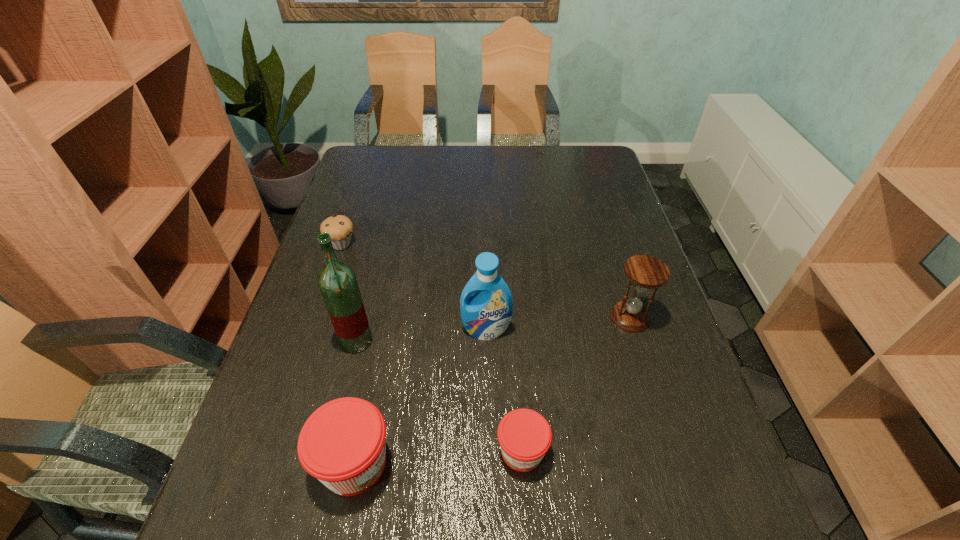
You are a GUI agent. You are given a task and a screenshot of the screen. Output one action in this format:
    pyautogui.click(x=<x>, y=<y>)
    Task: Click on the free space between the taller jam and the leftmost object
    The height and width of the screenshot is (540, 960).
    Given the screenshot: What is the action you would take?
    pyautogui.click(x=348, y=354)

Identify the location of vacant space that's between the second tallest object and the taller jam. The height and width of the screenshot is (540, 960). (420, 396).

At what (x,y) coordinates should I click in order to perform the action: click on vacant space that is in between the liquor and the right jam. Please return your answer as a coordinate pair (x, y). The image size is (960, 540). Looking at the image, I should click on (439, 396).

Where is `vacant space that's between the liquor and the detergent`? Image resolution: width=960 pixels, height=540 pixels. vacant space that's between the liquor and the detergent is located at coordinates (421, 335).

Select which object appears as the third closest to the right jam. Please provide its 2D coordinates. Your answer should be formatted as a tuple, i.e. [(x, y)], where the tuple contains the x and y coordinates of a point satisfying the conditions above.

[(646, 272)]

Choose which object is the nearest neighbor to the shorter jam. Please provide its 2D coordinates. Your answer should be formatted as a tuple, i.e. [(x, y)], where the tuple contains the x and y coordinates of a point satisfying the conditions above.

[(342, 444)]

You are a GUI agent. You are given a task and a screenshot of the screen. Output one action in this format:
    pyautogui.click(x=<x>, y=<y>)
    Task: Click on the free region that satisfies the following two spatial constraints: 1. on the front-facing side of the detergent; 2. on the label side of the left jam
    This screenshot has height=540, width=960.
    Given the screenshot: What is the action you would take?
    pyautogui.click(x=488, y=463)

Where is `vacant position in the image that satisfies the following two spatial constraints: 1. on the label side of the right jam; 2. on the label side of the left jam`? vacant position in the image that satisfies the following two spatial constraints: 1. on the label side of the right jam; 2. on the label side of the left jam is located at coordinates (523, 463).